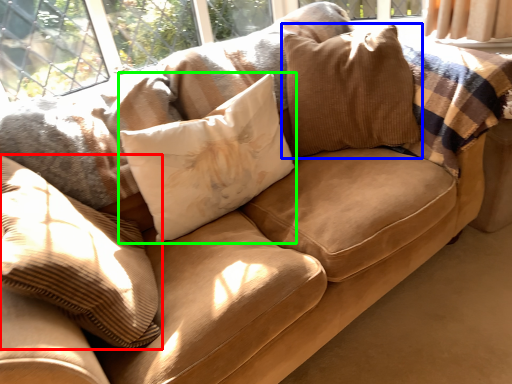
Question: Considering the real-world distances, which object is farthest from pillow (highlighted by a red box)? pillow (highlighted by a blue box) or pillow (highlighted by a green box)?

Choices:
 (A) pillow
 (B) pillow

Answer: (A)